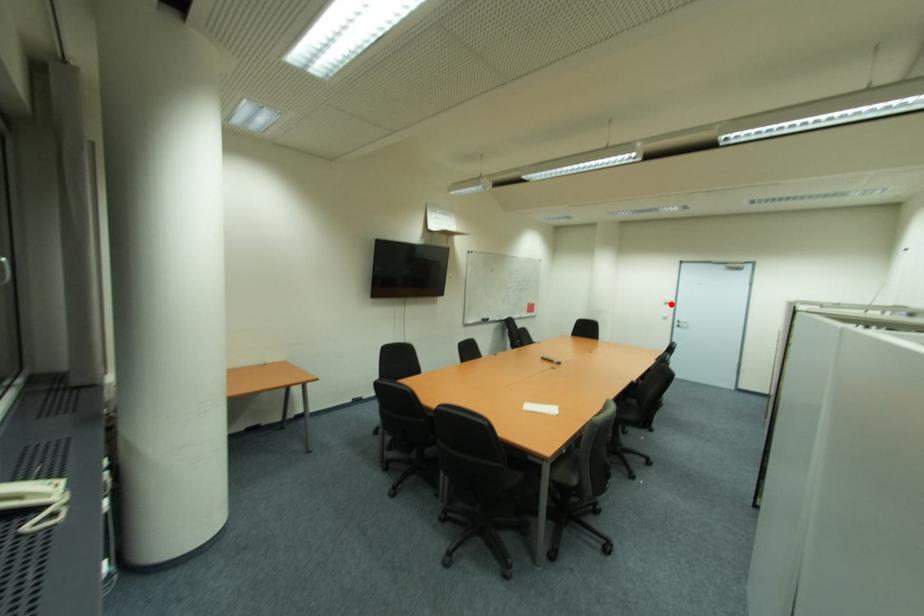
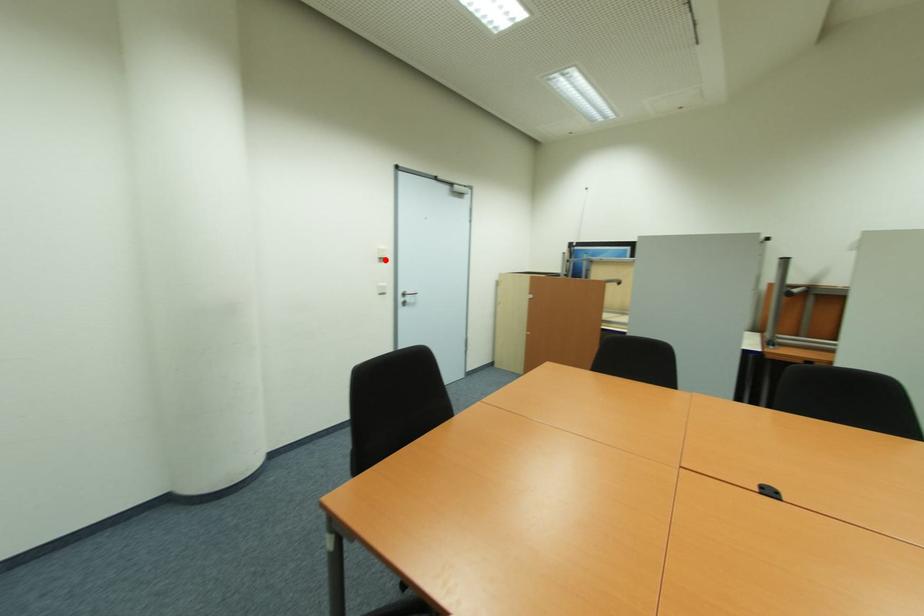
I am providing you with two images of the same scene from different viewpoints. A red point is marked on the first image and another point is marked on the second image. Do the highlighted points in image1 and image2 indicate the same real-world spot?

Yes